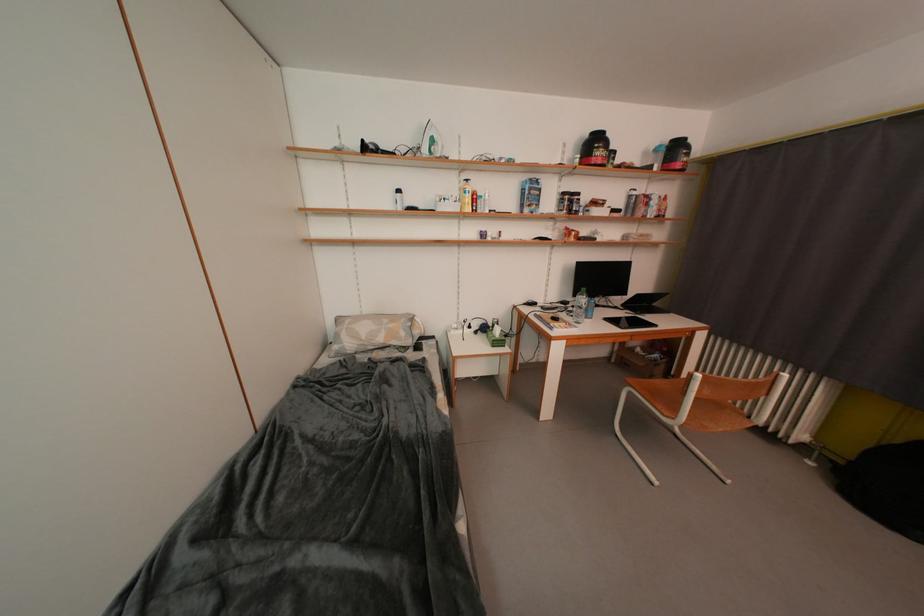
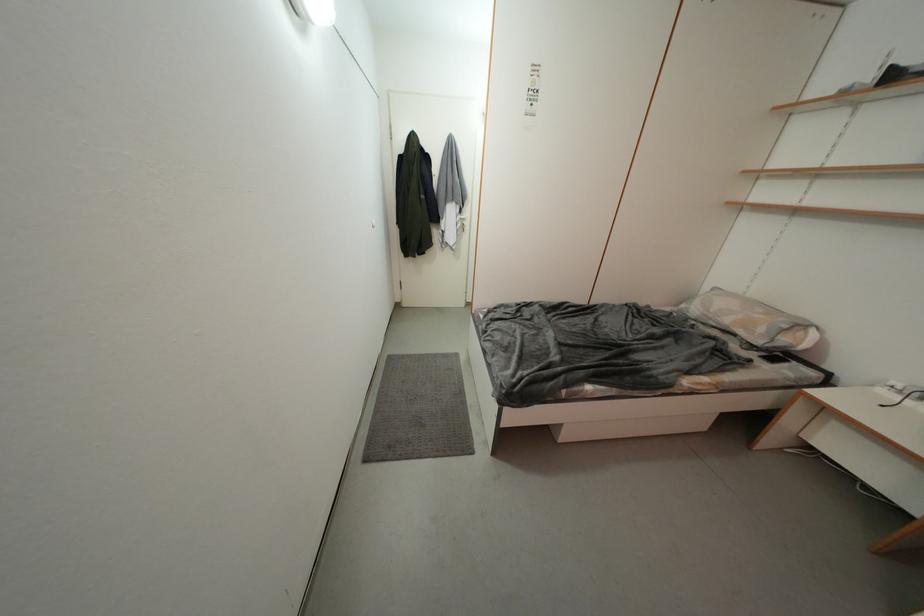
In the second image, find the point that corresponds to pixel 409 337 in the first image.

(769, 333)